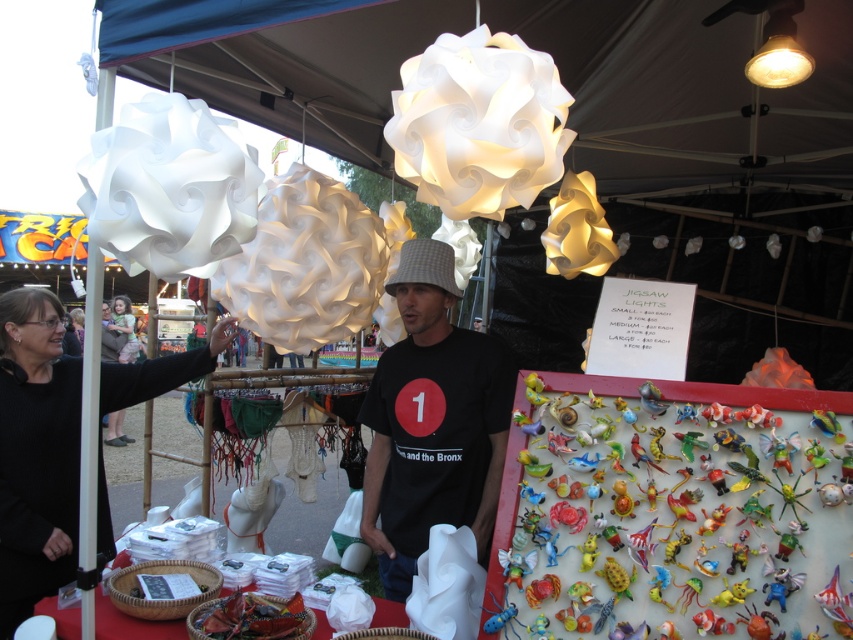
Question: Does black matte t-shirt at center appear on the left side of black fabric at left?

Choices:
 (A) yes
 (B) no

Answer: (B)

Question: Does white paper lampshades at upper center appear under white matte paper lantern at upper center?

Choices:
 (A) yes
 (B) no

Answer: (B)

Question: Which object is closer to the camera taking this photo?

Choices:
 (A) white matte paper lantern at upper left
 (B) white matte paper lantern at center

Answer: (A)

Question: Does white matte paper lantern at center have a larger size compared to matte white bulb at upper right?

Choices:
 (A) no
 (B) yes

Answer: (B)

Question: Estimate the real-world distances between objects in this image. Which object is closer to the white matte paper lantern at upper left?

Choices:
 (A) white matte paper lantern at center
 (B) matte white bulb at upper right
 (C) white matte paper lantern at upper center

Answer: (A)

Question: Among these objects, which one is nearest to the camera?

Choices:
 (A) black fabric at left
 (B) white paper lampshades at upper center

Answer: (A)